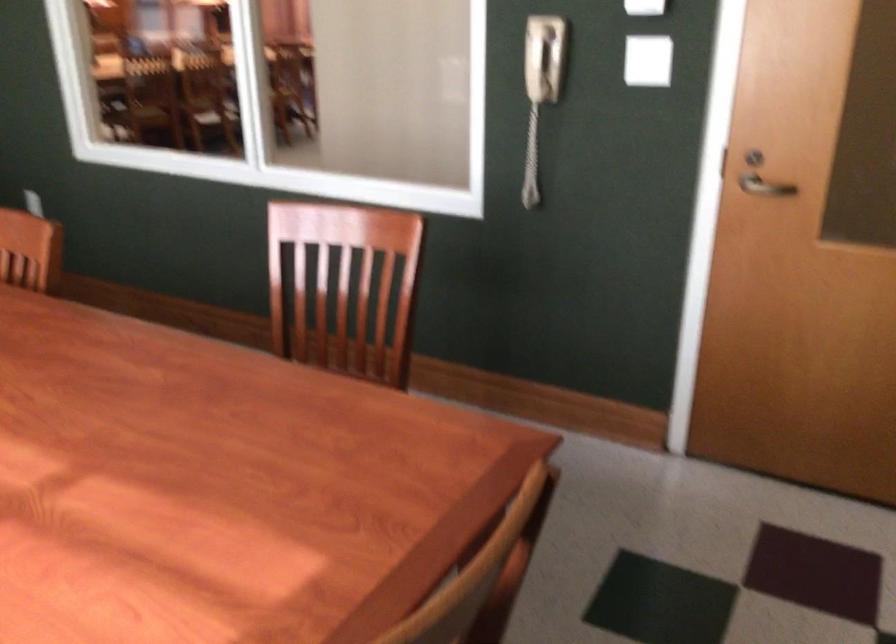
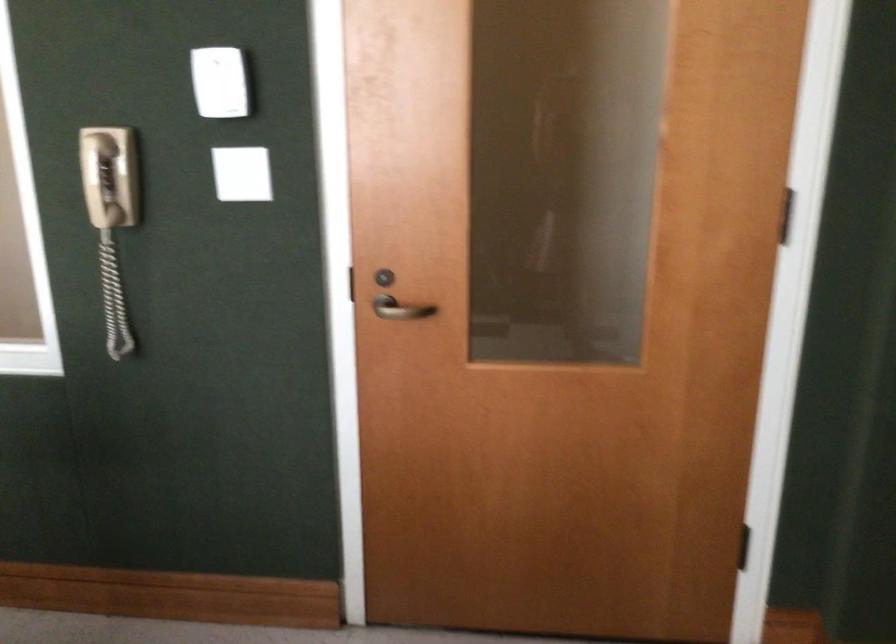
In a continuous first-person perspective shot, in which direction is the camera moving?

The cameraman walked toward right, forward.